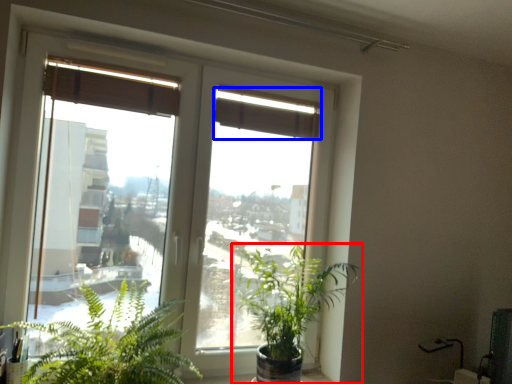
Question: Which object is further to the camera taking this photo, houseplant (highlighted by a red box) or curtain (highlighted by a blue box)?

Choices:
 (A) houseplant
 (B) curtain

Answer: (B)